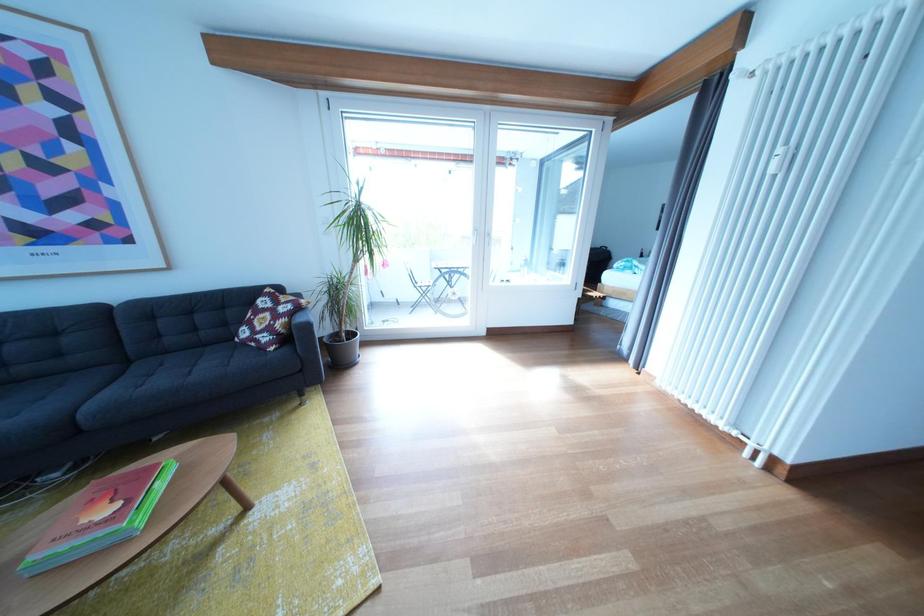
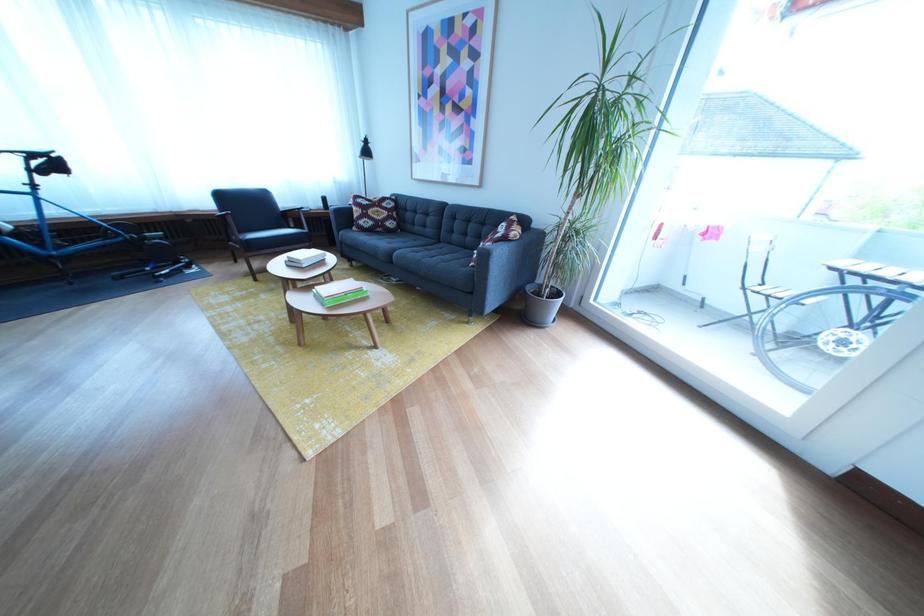
In the second image, find the point that corresponds to the point at 432,291 in the first image.

(771, 294)